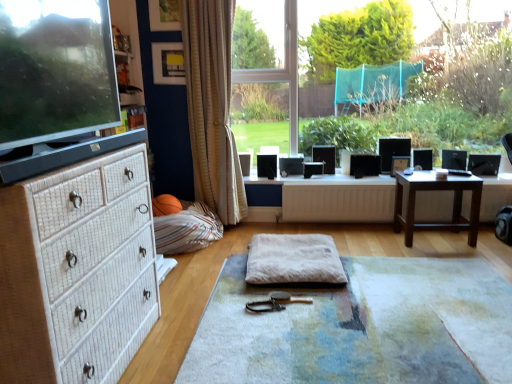
Find the location of a particular element. The image size is (512, 384). vacant area situated below white textured radiator at center (from a real-world perspective) is located at coordinates (334, 223).